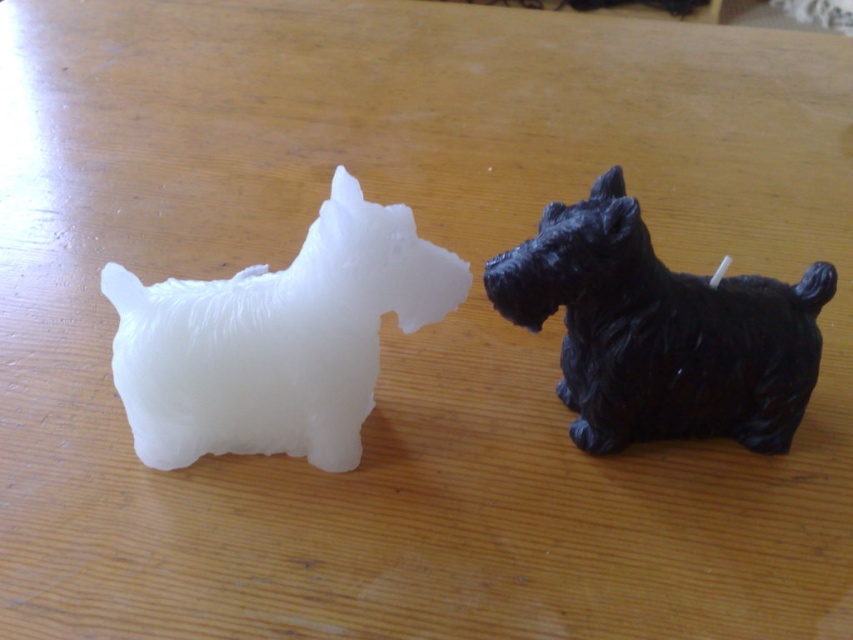
Is point (339, 369) closer to camera compared to point (746, 288)?

Yes, point (339, 369) is closer to viewer.

Can you confirm if white matte dog at left is bigger than black matte dog at center?

No, white matte dog at left is not bigger than black matte dog at center.

Between point (345, 388) and point (799, 417), which one is positioned behind?

Positioned behind is point (799, 417).

This screenshot has width=853, height=640. What are the coordinates of `white matte dog at left` in the screenshot? It's located at (276, 339).